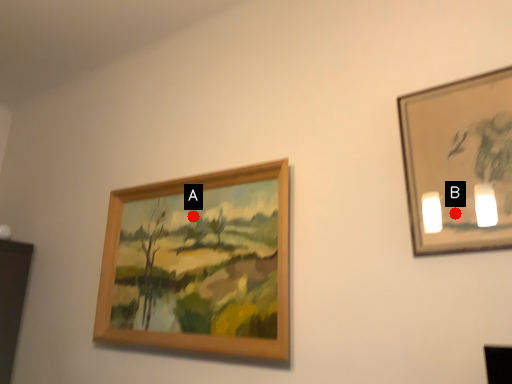
Question: Two points are circled on the image, labeled by A and B beside each circle. Which point is farther from the camera taking this photo?

Choices:
 (A) A is further
 (B) B is further

Answer: (A)